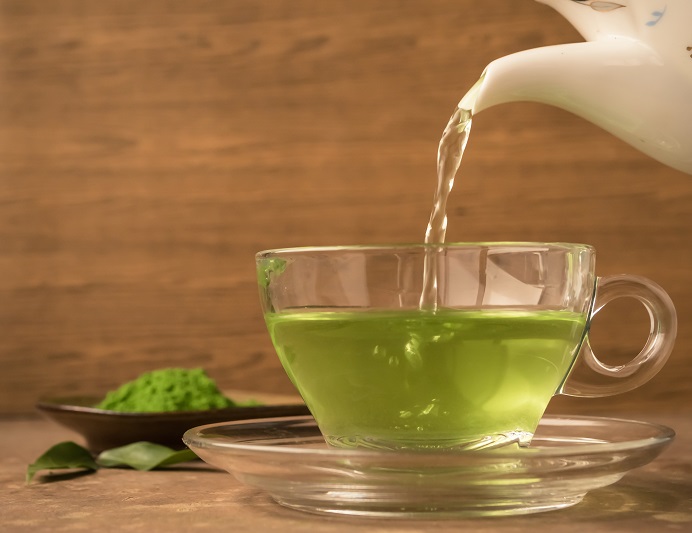
In order to click on tea cup handle in this screenshot , I will do `click(592, 372)`.